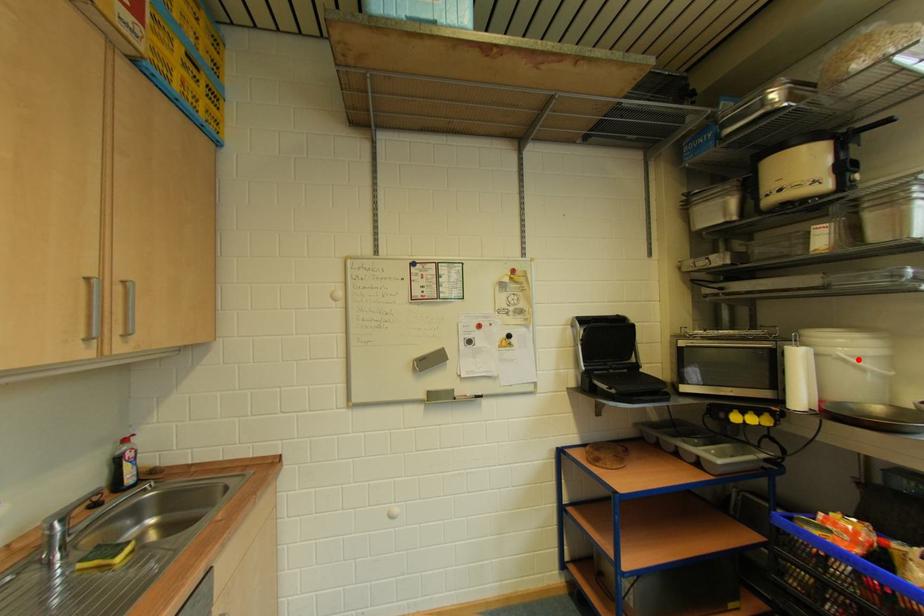
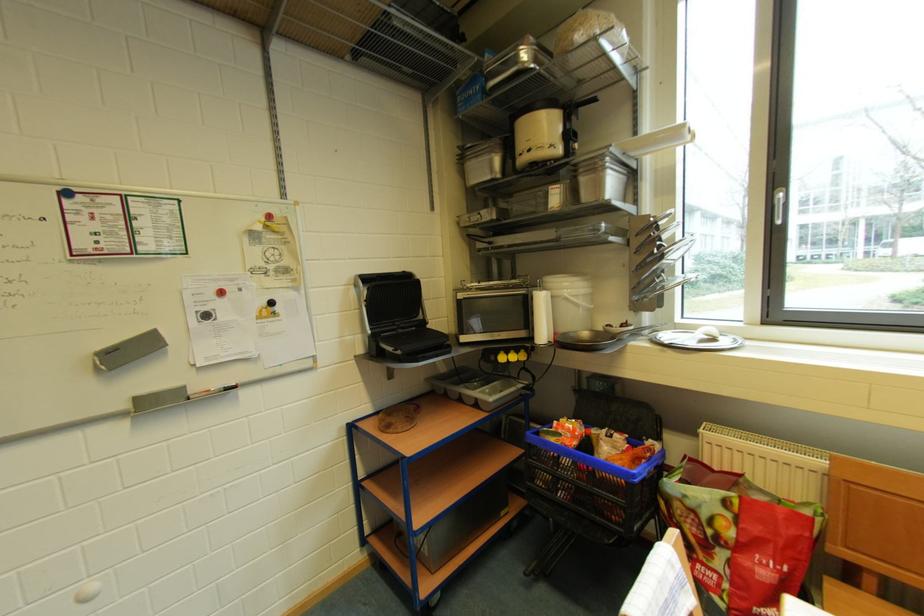
The point at the highlighted location is marked in the first image. Where is the corresponding point in the second image?

(578, 299)